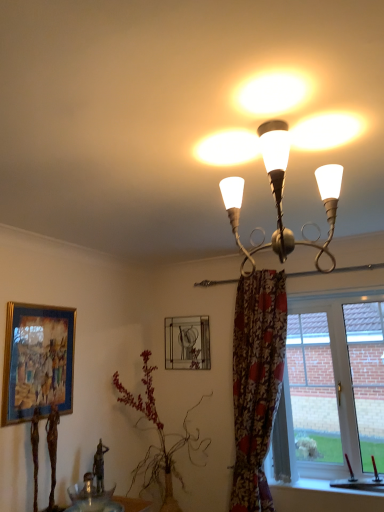
Question: Should I look upward or downward to see transparent glass bowl at lower left?

Choices:
 (A) down
 (B) up

Answer: (A)

Question: Is gold-framed painting at left, placed as the second picture frame when sorted from back to front, wider than metallic silver picture frame at upper center, which is counted as the 1th picture frame, starting from the back?

Choices:
 (A) no
 (B) yes

Answer: (A)

Question: Does gold-framed painting at left, which is counted as the 2th picture frame, starting from the right, have a larger size compared to metallic silver picture frame at upper center, which is counted as the 1th picture frame, starting from the back?

Choices:
 (A) yes
 (B) no

Answer: (A)

Question: Is gold-framed painting at left, the 1th picture frame viewed from the left, facing towards metallic silver picture frame at upper center, positioned as the 2th picture frame in left-to-right order?

Choices:
 (A) yes
 (B) no

Answer: (B)

Question: Does gold-framed painting at left, the 1th picture frame viewed from the left, appear on the right side of metallic silver picture frame at upper center, the second picture frame viewed from the front?

Choices:
 (A) no
 (B) yes

Answer: (A)

Question: Is metallic silver picture frame at upper center, the first picture frame from the right, completely or partially inside gold-framed painting at left, the 1th picture frame viewed from the left?

Choices:
 (A) no
 (B) yes

Answer: (A)

Question: Is gold-framed painting at left, which is counted as the 1th picture frame, starting from the front, taller than metallic silver picture frame at upper center, which is counted as the 1th picture frame, starting from the back?

Choices:
 (A) no
 (B) yes

Answer: (B)

Question: Does green leafy plant at center have a larger size compared to gold-framed painting at left, placed as the second picture frame when sorted from back to front?

Choices:
 (A) yes
 (B) no

Answer: (A)

Question: Is green leafy plant at center oriented away from gold-framed painting at left, the 1th picture frame viewed from the left?

Choices:
 (A) yes
 (B) no

Answer: (B)

Question: Are green leafy plant at center and gold-framed painting at left, which is counted as the 2th picture frame, starting from the right, located far from each other?

Choices:
 (A) yes
 (B) no

Answer: (B)

Question: Is green leafy plant at center to the left of gold-framed painting at left, placed as the second picture frame when sorted from back to front, from the viewer's perspective?

Choices:
 (A) yes
 (B) no

Answer: (B)

Question: Is green leafy plant at center thinner than gold-framed painting at left, which is counted as the 1th picture frame, starting from the front?

Choices:
 (A) yes
 (B) no

Answer: (B)

Question: From a real-world perspective, does green leafy plant at center stand above gold-framed painting at left, which is counted as the 1th picture frame, starting from the front?

Choices:
 (A) no
 (B) yes

Answer: (A)

Question: Is clear glass window at lower right far away from floral fabric curtain at right?

Choices:
 (A) yes
 (B) no

Answer: (B)